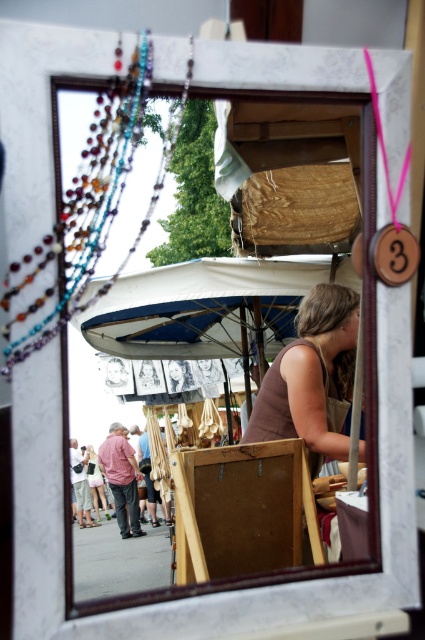
Is white fabric canopy at center above light pink fabric dress at lower left?

Correct, white fabric canopy at center is located above light pink fabric dress at lower left.

Does white fabric canopy at center have a greater height compared to light pink fabric dress at lower left?

In fact, white fabric canopy at center may be shorter than light pink fabric dress at lower left.

Describe the element at coordinates (200, 307) in the screenshot. I see `white fabric canopy at center` at that location.

I want to click on white fabric canopy at center, so click(200, 307).

Is brown matte tank top at center wider than light pink fabric dress at lower left?

Incorrect, brown matte tank top at center's width does not surpass light pink fabric dress at lower left's.

Does point (241, 436) come closer to viewer compared to point (107, 506)?

Yes, it is in front of point (107, 506).

Locate an element on the screen. The height and width of the screenshot is (640, 425). brown matte tank top at center is located at coordinates (311, 378).

Does point (39, 253) come in front of point (272, 388)?

Yes, it is in front of point (272, 388).

Is point (65, 288) positioned in front of point (289, 371)?

Yes, it is.

Locate an element on the screen. Image resolution: width=425 pixels, height=640 pixels. multicolored beaded necklace at upper left is located at coordinates (85, 209).